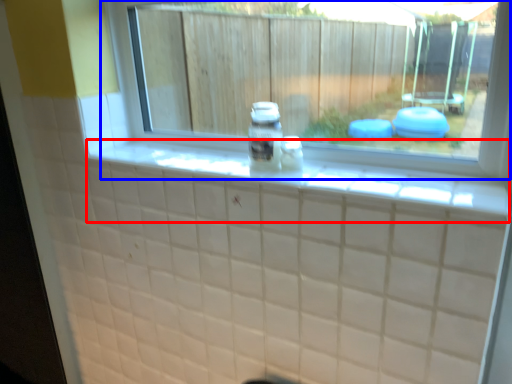
Question: Among these objects, which one is nearest to the camera, ledge (highlighted by a red box) or window (highlighted by a blue box)?

Choices:
 (A) ledge
 (B) window

Answer: (A)